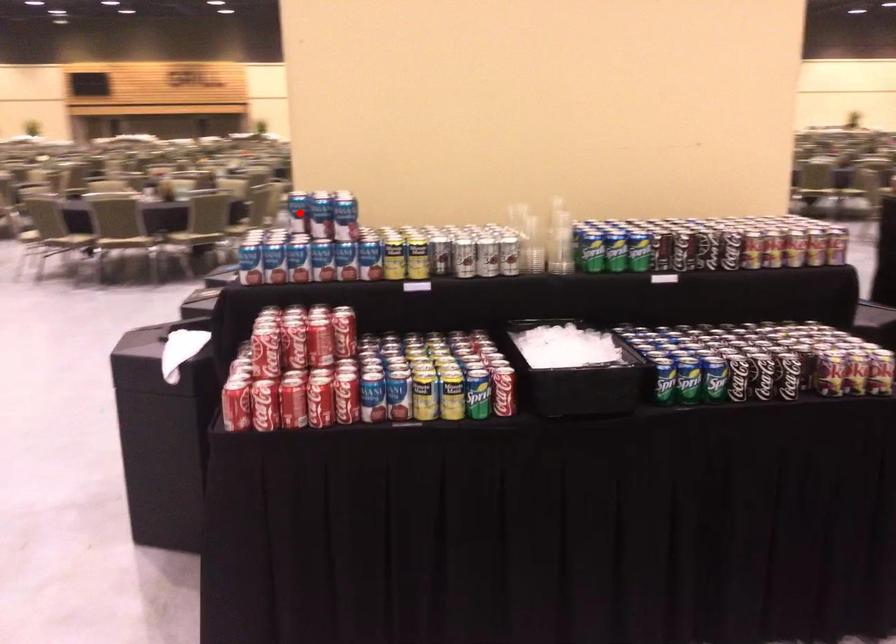
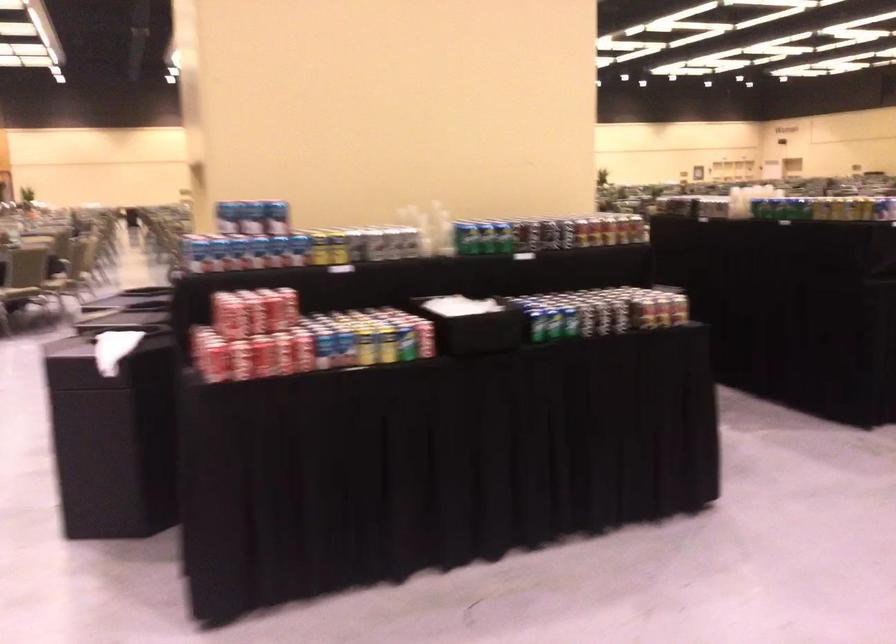
In the second image, find the point that corresponds to the highlighted location in the first image.

(229, 216)